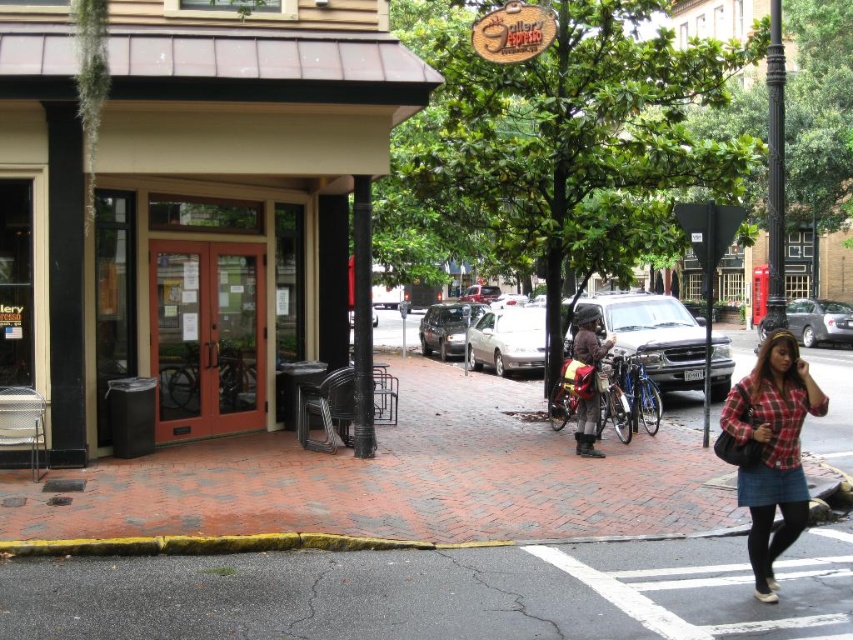
You are a delivery person trying to park your 2.5 meters wide truck between the silver metallic sedan at center and the silver metallic sedan at right. Can you fit your truck in the space between them?

The silver metallic sedan at center is narrower than the silver metallic sedan at right, but the total space between them isn

You are standing at the point marked as point (189, 202) in the image. Looking around, you see the brown wood door at center. Which direction should you walk to reach the entrance of the gallery building on the left?

The point (189, 202) is on the brown wood door at center. To reach the entrance of the gallery building on the left, you should walk to the left from the brown wood door at center.